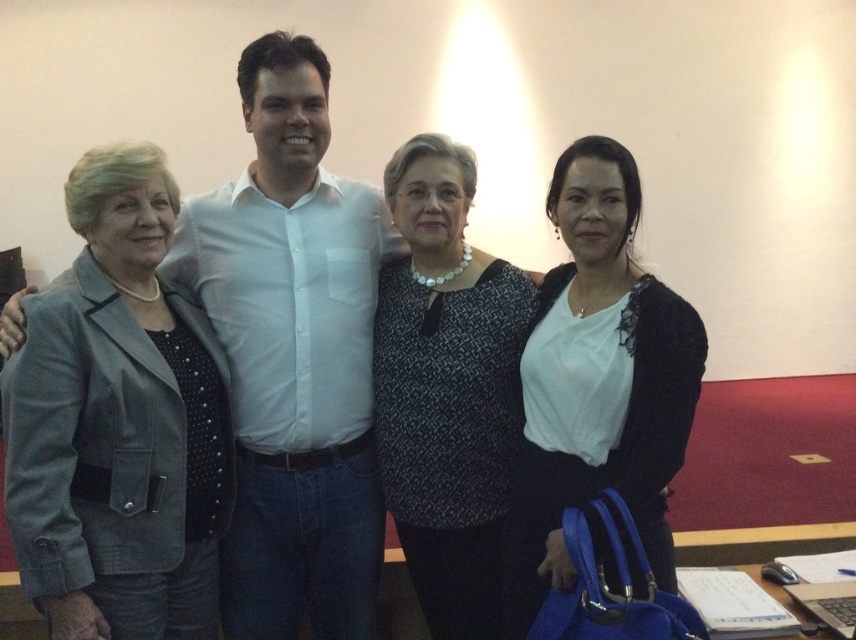
Question: Does gray fabric jacket at left have a larger size compared to patterned fabric blouse at center?

Choices:
 (A) no
 (B) yes

Answer: (B)

Question: Which object is positioned closest to the gray fabric jacket at left?

Choices:
 (A) white matte shirt at center
 (B) patterned fabric blouse at center

Answer: (B)

Question: Which is farther from the white matte shirt at center?

Choices:
 (A) gray fabric jacket at left
 (B) patterned fabric blouse at center

Answer: (A)

Question: Is white matte shirt at center smaller than patterned fabric blouse at center?

Choices:
 (A) yes
 (B) no

Answer: (B)

Question: Does gray fabric jacket at left have a smaller size compared to patterned fabric blouse at center?

Choices:
 (A) no
 (B) yes

Answer: (A)

Question: Estimate the real-world distances between objects in this image. Which object is farther from the patterned fabric blouse at center?

Choices:
 (A) gray fabric jacket at left
 (B) white matte shirt at center

Answer: (A)